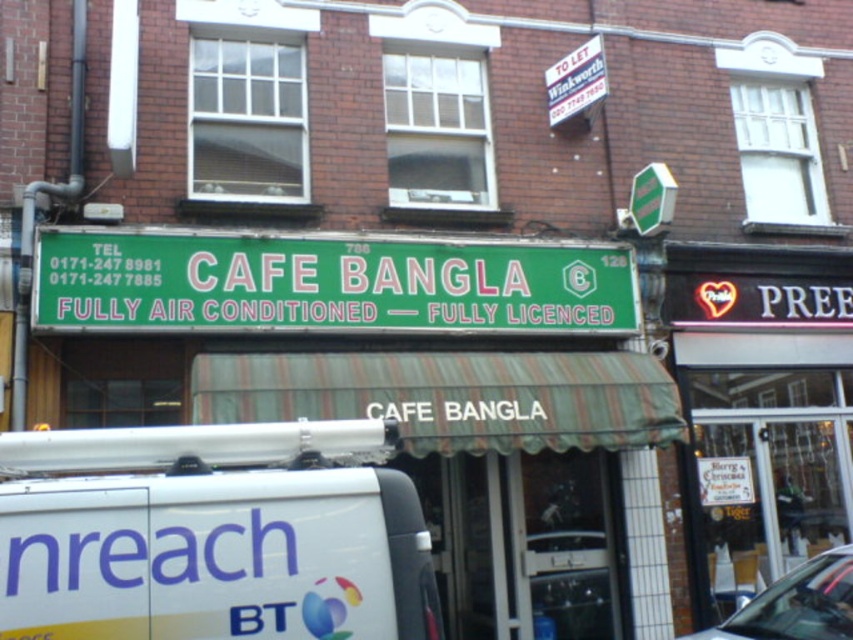
Question: Among these objects, which one is farthest from the camera?

Choices:
 (A) metallic silver car at lower right
 (B) green plastic sign at center

Answer: (B)

Question: Does white matte van at lower left lie in front of green plastic sign at center?

Choices:
 (A) yes
 (B) no

Answer: (A)

Question: Which object appears closest to the camera in this image?

Choices:
 (A) metallic silver car at lower right
 (B) green plastic sign at center
 (C) white matte van at lower left

Answer: (C)

Question: Which of the following is the farthest from the observer?

Choices:
 (A) white matte van at lower left
 (B) green plastic sign at center

Answer: (B)

Question: Is green plastic sign at center wider than metallic silver car at lower right?

Choices:
 (A) no
 (B) yes

Answer: (B)

Question: Observing the image, what is the correct spatial positioning of white matte van at lower left in reference to green plastic sign at center?

Choices:
 (A) above
 (B) below

Answer: (B)